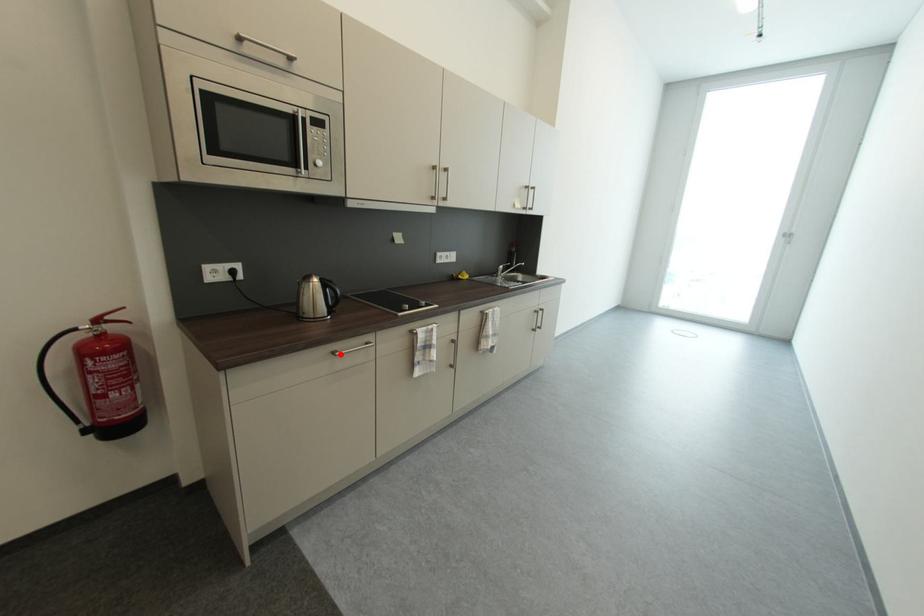
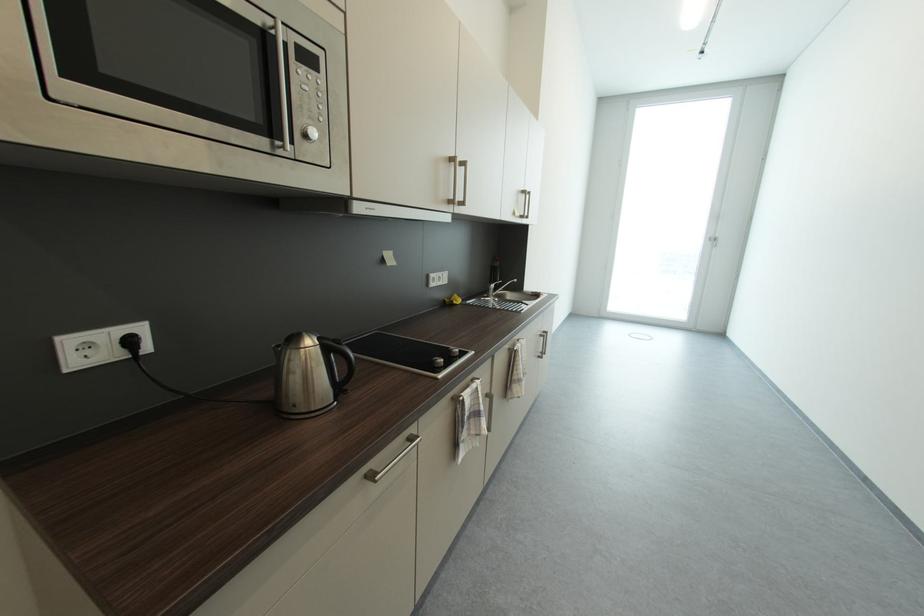
In the second image, find the point that corresponds to the highlighted location in the first image.

(377, 479)